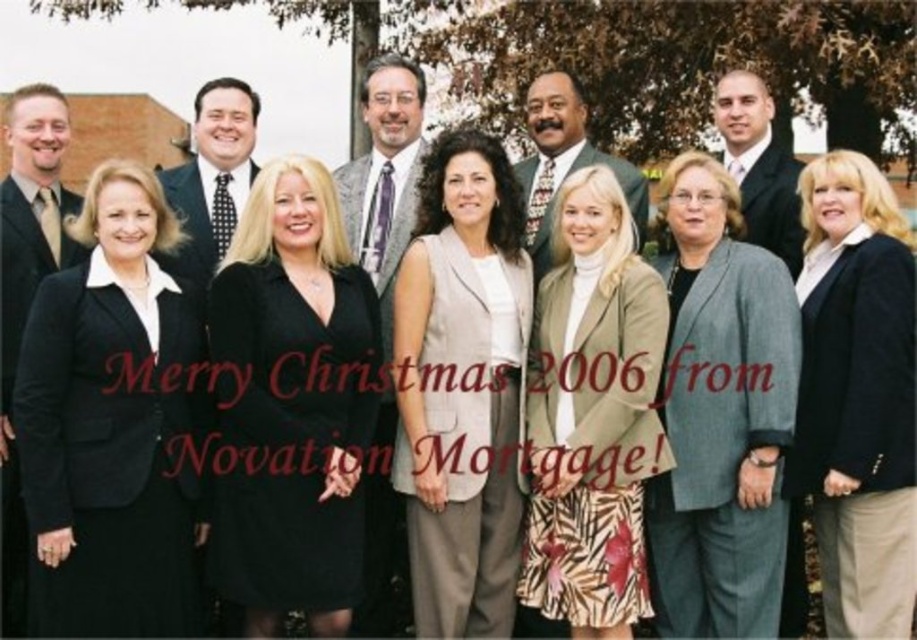
Is point (311, 252) positioned in front of point (255, 100)?

Yes, point (311, 252) is in front of point (255, 100).

This screenshot has height=640, width=917. What are the coordinates of `black matte dress at center` in the screenshot? It's located at (291, 404).

Is matte gray suit at center smaller than matte black suit at right?

No, matte gray suit at center is not smaller than matte black suit at right.

Who is positioned more to the right, matte gray suit at center or matte black suit at right?

Positioned to the right is matte black suit at right.

Does point (389, 138) come in front of point (750, 93)?

No, it is behind (750, 93).

Where is `matte gray suit at center`? This screenshot has height=640, width=917. matte gray suit at center is located at coordinates (384, 173).

Is point (374, 228) closer to viewer compared to point (573, 115)?

That is True.

Who is lower down, matte gray suit at center or green textured suit at center?

matte gray suit at center is below.

This screenshot has height=640, width=917. Describe the element at coordinates (384, 173) in the screenshot. I see `matte gray suit at center` at that location.

Locate an element on the screen. This screenshot has height=640, width=917. matte gray suit at center is located at coordinates (384, 173).